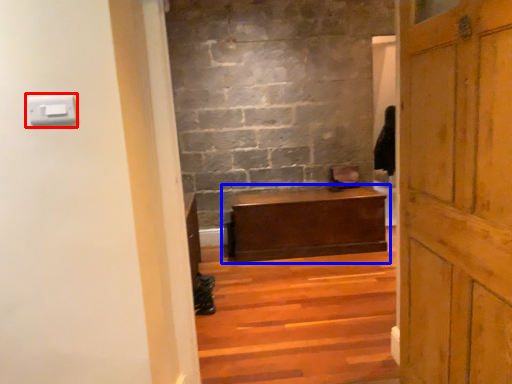
Question: Which object is further to the camera taking this photo, light switch (highlighted by a red box) or table (highlighted by a blue box)?

Choices:
 (A) light switch
 (B) table

Answer: (B)